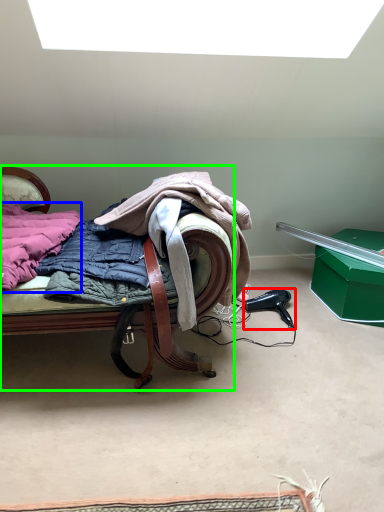
Question: Which is nearer to the hair drier (highlighted by a red box)? underclothes (highlighted by a blue box) or furniture (highlighted by a green box).

Choices:
 (A) underclothes
 (B) furniture

Answer: (B)